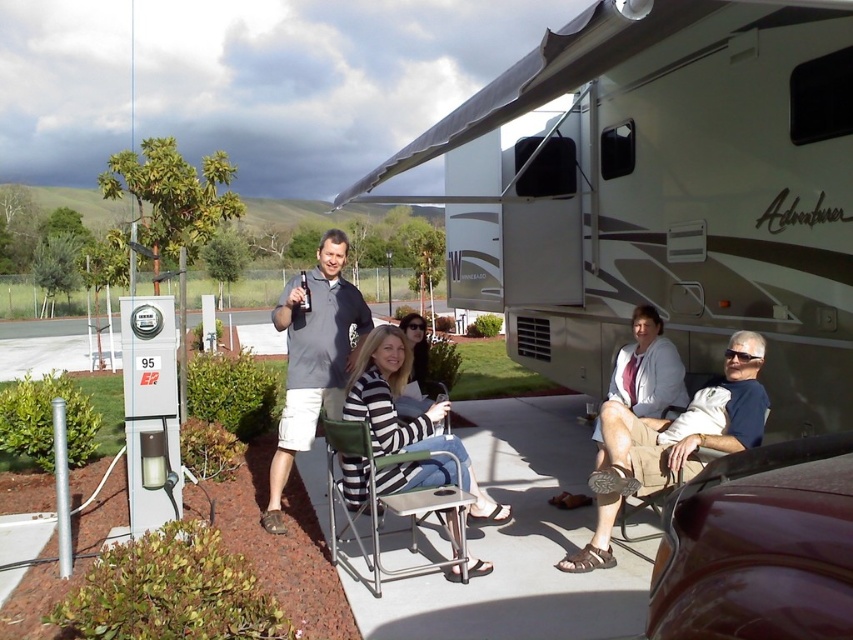
Question: Does gray cotton shirt at center appear on the left side of green fabric folding chair at center?

Choices:
 (A) yes
 (B) no

Answer: (A)

Question: Which point is closer to the camera?

Choices:
 (A) gray cotton shirt at center
 (B) green fabric folding chair at center

Answer: (B)

Question: Can you confirm if striped fabric shirt at center is positioned to the right of dark blue t-shirt at center?

Choices:
 (A) no
 (B) yes

Answer: (B)

Question: Considering the real-world distances, which object is farthest from the striped fabric jacket at center?

Choices:
 (A) metallic silver chair at lower right
 (B) dark blue t-shirt at center
 (C) green fabric folding chair at center
 (D) white textured rv at center

Answer: (D)

Question: Which point is farther from the camera taking this photo?

Choices:
 (A) (747, 337)
 (B) (836, 257)

Answer: (A)

Question: Does striped fabric jacket at center appear under green fabric folding chair at center?

Choices:
 (A) yes
 (B) no

Answer: (B)